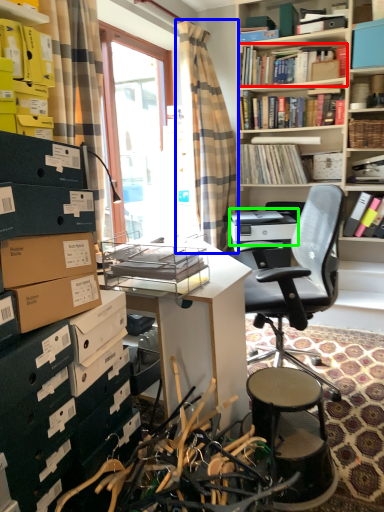
Question: Which object is the closest to the book (highlighted by a red box)? Choose among these: curtain (highlighted by a blue box) or printer (highlighted by a green box).

Choices:
 (A) curtain
 (B) printer

Answer: (A)